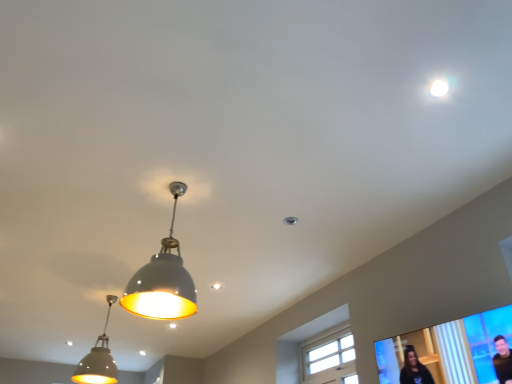
Question: Is the position of matte black screen at lower right more distant than that of white glossy droplight at upper right?

Choices:
 (A) yes
 (B) no

Answer: (B)

Question: Is matte black screen at lower right aimed at white glossy droplight at upper right?

Choices:
 (A) no
 (B) yes

Answer: (A)

Question: Is matte black screen at lower right smaller than white glossy droplight at upper right?

Choices:
 (A) yes
 (B) no

Answer: (B)

Question: Is matte black screen at lower right looking in the opposite direction of white glossy droplight at upper right?

Choices:
 (A) yes
 (B) no

Answer: (B)

Question: From a real-world perspective, is matte black screen at lower right physically above white glossy droplight at upper right?

Choices:
 (A) no
 (B) yes

Answer: (A)

Question: Based on their sizes in the image, would you say matte gray lampshade at center, the first lamp when ordered from front to back, is bigger or smaller than white wood window at center?

Choices:
 (A) big
 (B) small

Answer: (A)

Question: In terms of height, does matte gray lampshade at center, the first lamp when ordered from front to back, look taller or shorter compared to white wood window at center?

Choices:
 (A) short
 (B) tall

Answer: (B)

Question: Is point (165, 301) positioned closer to the camera than point (318, 377)?

Choices:
 (A) closer
 (B) farther

Answer: (A)

Question: In the image, is matte gray lampshade at center, which is the 2th lamp from left to right, on the left side or the right side of white wood window at center?

Choices:
 (A) left
 (B) right

Answer: (A)

Question: Does point (330, 367) appear closer or farther from the camera than point (175, 200)?

Choices:
 (A) closer
 (B) farther

Answer: (B)

Question: From their relative heights in the image, would you say white wood window at center is taller or shorter than matte gray lampshade at center, which is the 2th lamp from left to right?

Choices:
 (A) tall
 (B) short

Answer: (B)

Question: Based on their sizes in the image, would you say white wood window at center is bigger or smaller than matte gray lampshade at center, which ranks as the 2th lamp in bottom-to-top order?

Choices:
 (A) big
 (B) small

Answer: (B)

Question: Considering the positions of white wood window at center and matte gray lampshade at center, the first lamp when ordered from front to back, in the image, is white wood window at center wider or thinner than matte gray lampshade at center, the first lamp when ordered from front to back,?

Choices:
 (A) thin
 (B) wide

Answer: (A)

Question: From a real-world perspective, is white wood window at center above or below matte gray pendant light at lower left, which is counted as the second lamp, starting from the top?

Choices:
 (A) above
 (B) below

Answer: (B)

Question: Would you say white wood window at center is inside or outside matte gray pendant light at lower left, which is counted as the first lamp, starting from the left?

Choices:
 (A) inside
 (B) outside

Answer: (B)